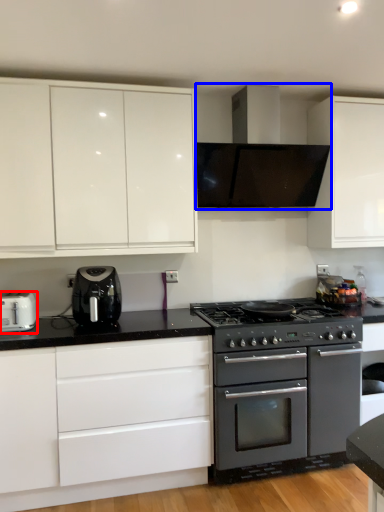
Question: Which of the following is the farthest to the observer, toaster (highlighted by a red box) or home appliance (highlighted by a blue box)?

Choices:
 (A) toaster
 (B) home appliance

Answer: (B)